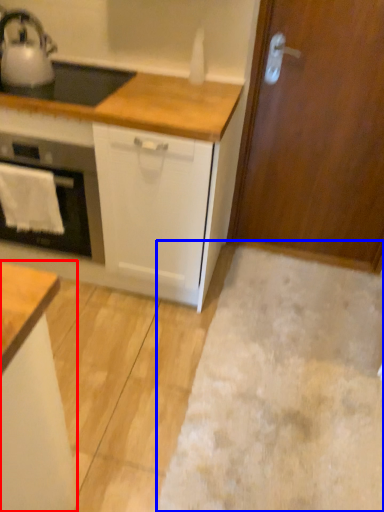
Question: Which of the following is the closest to the observer, cabinetry (highlighted by a red box) or plain (highlighted by a blue box)?

Choices:
 (A) cabinetry
 (B) plain

Answer: (A)